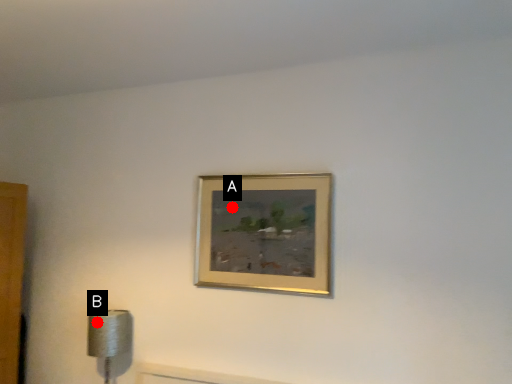
Question: Two points are circled on the image, labeled by A and B beside each circle. Which point is farther to the camera?

Choices:
 (A) A is further
 (B) B is further

Answer: (B)